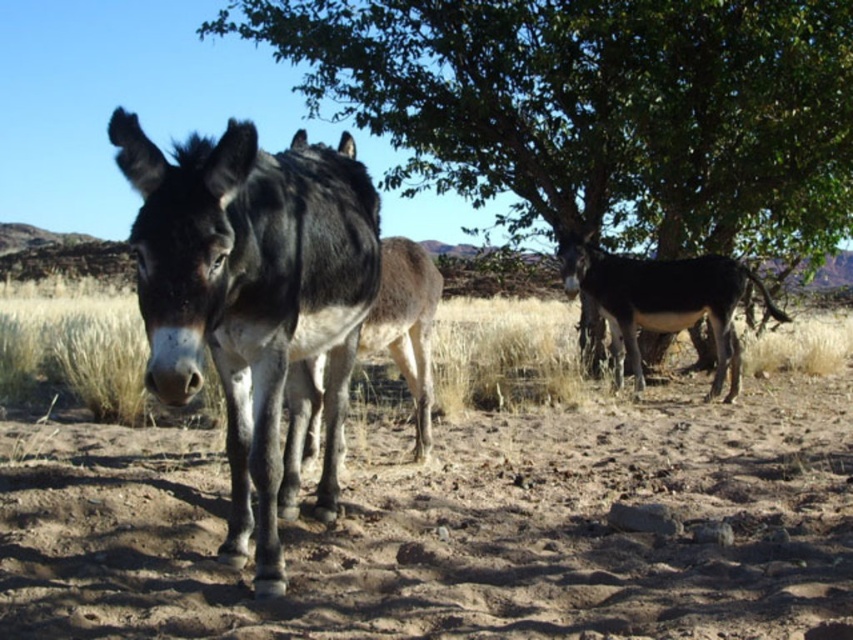
You are a photographer trying to capture a photo of the dark brown glossy mule at right. You are standing on the brown sandy dirt at center. To get a clear shot of the mule, should you move to your left or right?

The brown sandy dirt at center is positioned on the left side of dark brown glossy mule at right. To get a clear shot of the dark brown glossy mule at right, you should move to your right to avoid being blocked by the mule itself or any obstacles between you and it.

You are a hiker who wants to rest under the shade of the green leafy tree at center. However, you notice the dark brown glossy mule at right is nearby. Based on their positions, can you safely walk directly towards the tree without passing too close to the mule?

The green leafy tree at center is above the dark brown glossy mule at right, meaning the tree is positioned higher up in the image. Since the mule is at the right and the tree is centrally located above it, you can safely walk towards the tree without getting too close to the mule as they are not directly in line.